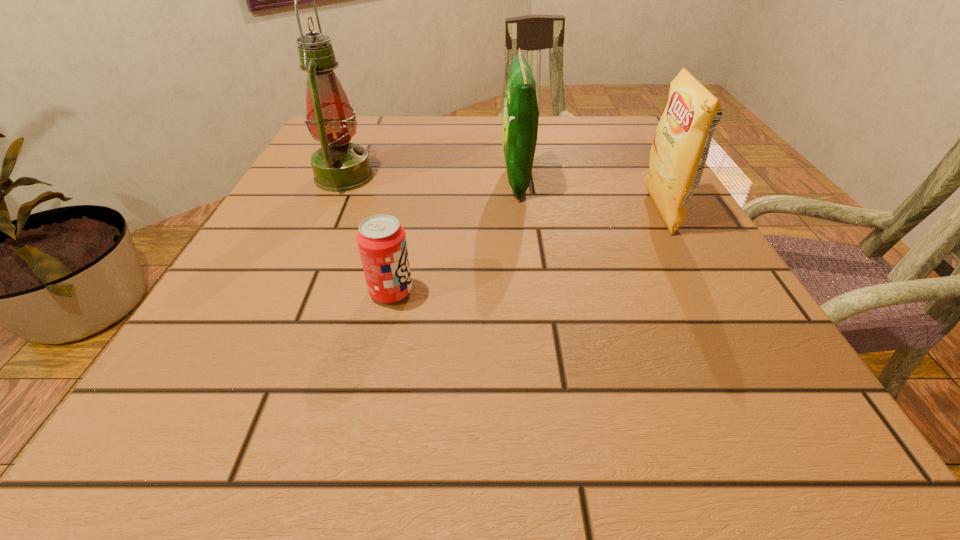
Image resolution: width=960 pixels, height=540 pixels. Identify the location of vacant space located on the front-facing side of the third object from left to right. (448, 181).

You are a GUI agent. You are given a task and a screenshot of the screen. Output one action in this format:
    pyautogui.click(x=<x>, y=<y>)
    Task: Click on the free space located 0.050m on the front-facing side of the third object from left to right
    
    Given the screenshot: What is the action you would take?
    pyautogui.click(x=477, y=181)

This screenshot has height=540, width=960. Find the location of `free space located 0.130m on the front-facing side of the third object from left to right`. free space located 0.130m on the front-facing side of the third object from left to right is located at coordinates (439, 181).

Locate an element on the screen. The width and height of the screenshot is (960, 540). free spot located 0.390m on the surface of the third object from right to left is located at coordinates click(x=669, y=292).

Locate an element on the screen. The width and height of the screenshot is (960, 540). object positioned at the far edge is located at coordinates (339, 166).

I want to click on object located at the left edge, so click(339, 166).

I want to click on object at the right edge, so click(x=680, y=148).

Find the location of `object at the far left corner`. object at the far left corner is located at coordinates (339, 166).

Locate an element on the screen. vacant area at the far edge of the desktop is located at coordinates (394, 136).

Identify the location of free space at the near edge of the desktop. (548, 466).